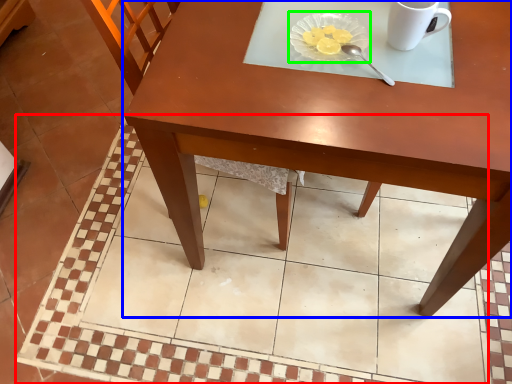
Question: Estimate the real-world distances between objects in this image. Which object is closer to square (highlighted by a red box), table (highlighted by a blue box) or glass plate (highlighted by a green box)?

Choices:
 (A) table
 (B) glass plate

Answer: (A)